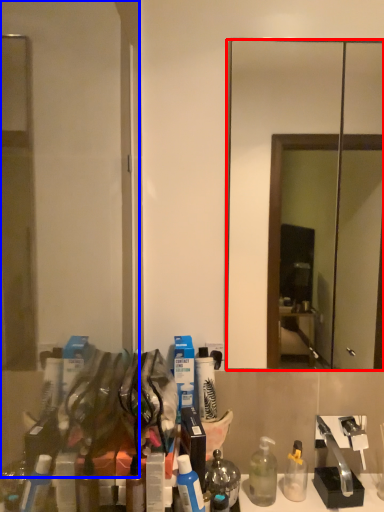
Question: Among these objects, which one is farthest to the camera, mirror (highlighted by a red box) or glass door (highlighted by a blue box)?

Choices:
 (A) mirror
 (B) glass door

Answer: (A)